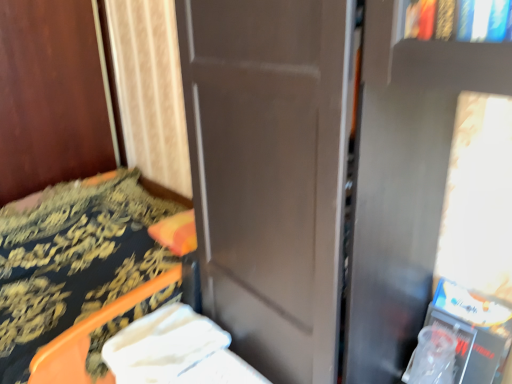
Question: Considering their positions, is white fabric at lower left located in front of or behind orange plastic chair at lower left?

Choices:
 (A) front
 (B) behind

Answer: (B)

Question: From a real-world perspective, is white fabric at lower left above or below orange plastic chair at lower left?

Choices:
 (A) above
 (B) below

Answer: (B)

Question: Considering the positions of white fabric at lower left and orange plastic chair at lower left in the image, is white fabric at lower left bigger or smaller than orange plastic chair at lower left?

Choices:
 (A) small
 (B) big

Answer: (A)

Question: Is orange plastic chair at lower left wider or thinner than white fabric at lower left?

Choices:
 (A) wide
 (B) thin

Answer: (A)

Question: In terms of size, does orange plastic chair at lower left appear bigger or smaller than white fabric at lower left?

Choices:
 (A) big
 (B) small

Answer: (A)

Question: From a real-world perspective, is orange plastic chair at lower left above or below white fabric at lower left?

Choices:
 (A) above
 (B) below

Answer: (A)

Question: From the image's perspective, is orange plastic chair at lower left above or below white fabric at lower left?

Choices:
 (A) above
 (B) below

Answer: (A)